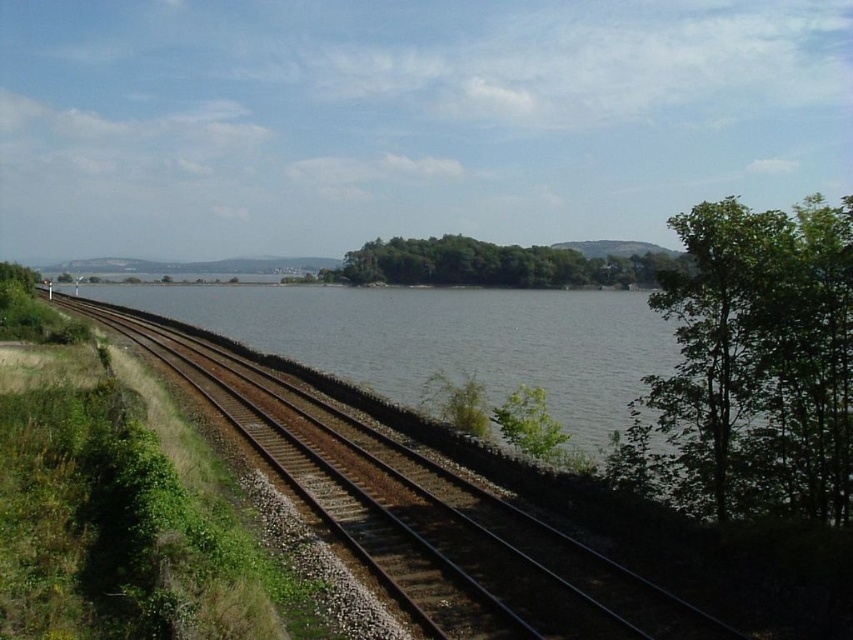
Question: Which point appears closest to the camera in this image?

Choices:
 (A) (393, 516)
 (B) (570, 259)

Answer: (A)

Question: Is green leafy tree at right positioned before green leafy island at center?

Choices:
 (A) yes
 (B) no

Answer: (A)

Question: Among these points, which one is nearest to the camera?

Choices:
 (A) (451, 576)
 (B) (657, 408)

Answer: (A)

Question: Does green leafy tree at right have a lesser width compared to green leafy island at center?

Choices:
 (A) yes
 (B) no

Answer: (A)

Question: Which point is closer to the camera?

Choices:
 (A) green leafy island at center
 (B) green leafy tree at right

Answer: (B)

Question: Does green leafy tree at right appear over green leafy island at center?

Choices:
 (A) yes
 (B) no

Answer: (B)